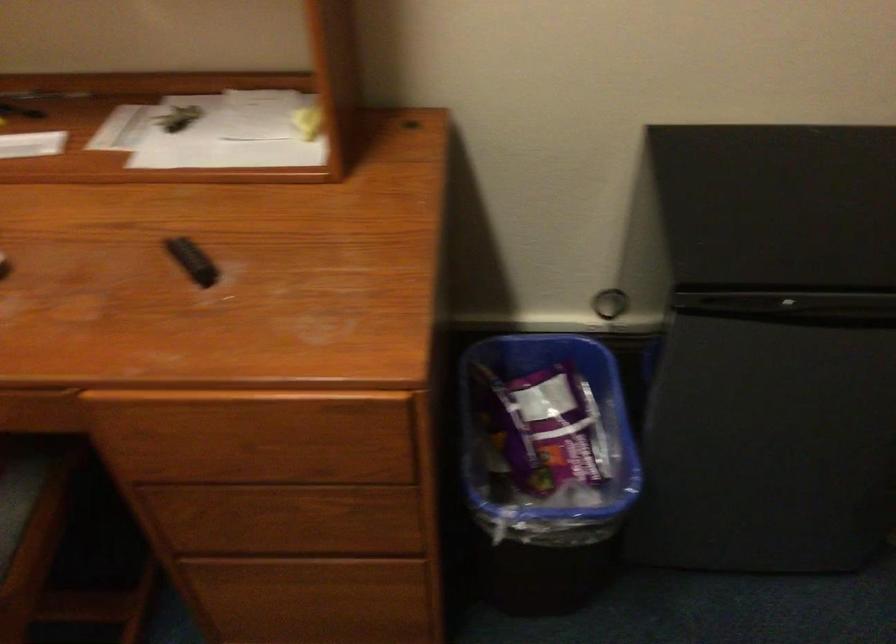
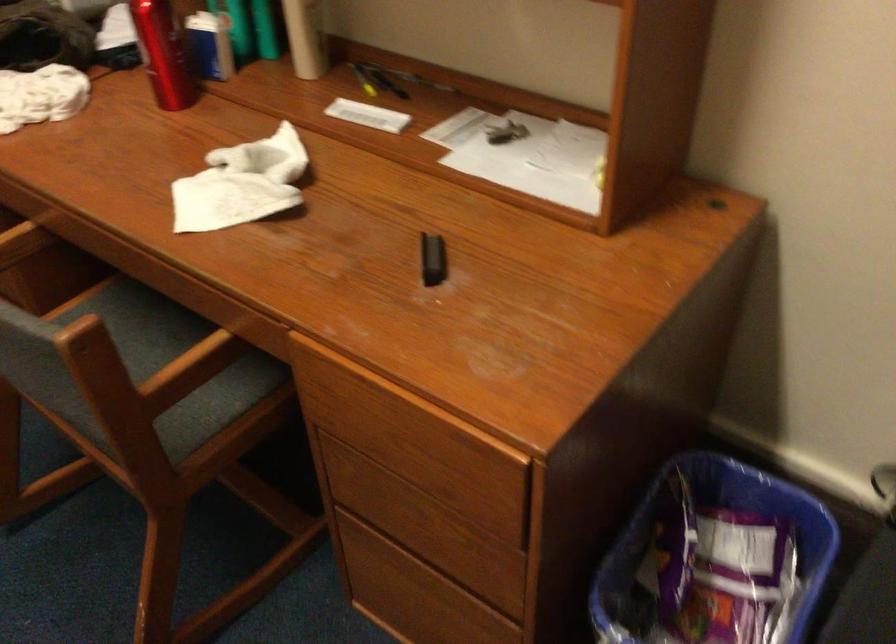
In the second image, find the point that corresponds to point 194,261 in the first image.

(433, 259)